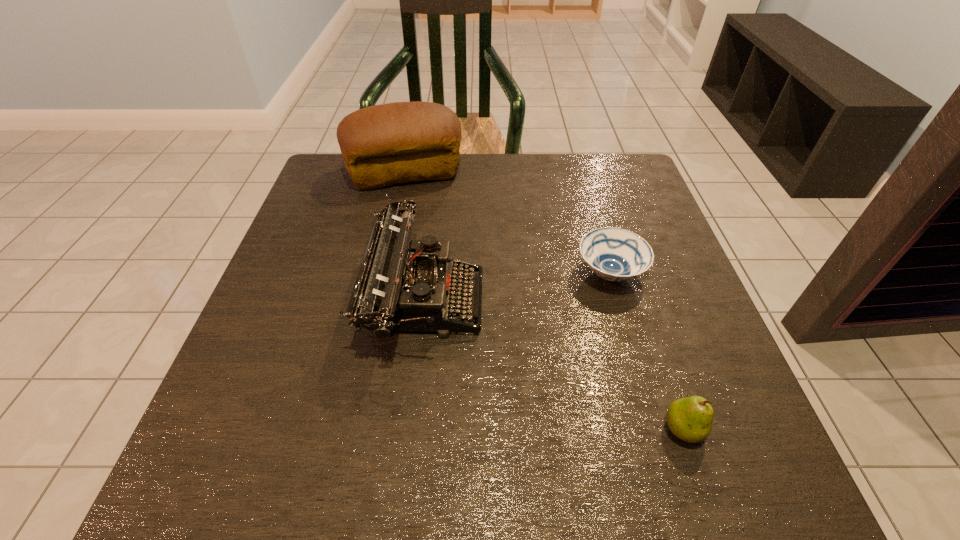
Identify the location of free space between the nearest object and the soup bowl. [646, 351].

Locate an element on the screen. Image resolution: width=960 pixels, height=540 pixels. empty space between the farthest object and the nearest object is located at coordinates (544, 301).

Identify the location of empty space that is in between the typewriter and the tallest object. This screenshot has height=540, width=960. (416, 236).

Where is `free space between the pear and the shortest object`? free space between the pear and the shortest object is located at coordinates (x=646, y=351).

Select which object is the closest to the bread. Please provide its 2D coordinates. Your answer should be formatted as a tuple, i.e. [(x, y)], where the tuple contains the x and y coordinates of a point satisfying the conditions above.

[(397, 289)]

Where is `object that is the third closest one to the tallest object`? object that is the third closest one to the tallest object is located at coordinates (690, 419).

The image size is (960, 540). Identify the location of vacant space that satisfies the following two spatial constraints: 1. on the front side of the pear; 2. on the right side of the soup bowl. (654, 429).

You are a GUI agent. You are given a task and a screenshot of the screen. Output one action in this format:
    pyautogui.click(x=<x>, y=<y>)
    Task: Click on the vacant area in the image that satisfies the following two spatial constraints: 1. on the keyboard of the typewriter; 2. on the right side of the second shortest object
    This screenshot has width=960, height=540.
    Given the screenshot: What is the action you would take?
    pyautogui.click(x=409, y=429)

This screenshot has width=960, height=540. What are the coordinates of `free spot that satisfies the following two spatial constraints: 1. on the front side of the tallest object; 2. on the right side of the second shortest object` in the screenshot? It's located at (352, 429).